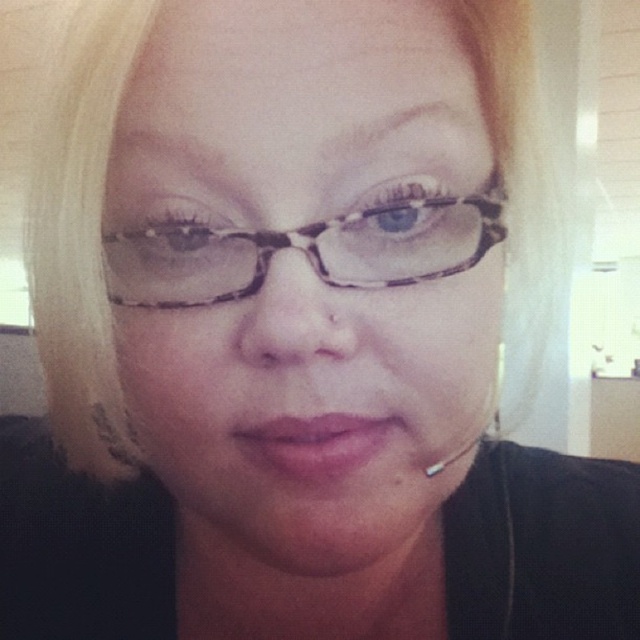
Question: Among these objects, which one is nearest to the camera?

Choices:
 (A) matte black glasses at center
 (B) pink matte lips at center
 (C) translucent tortoiseshell glasses at center

Answer: (A)

Question: Can you confirm if matte black glasses at center is positioned to the right of pink matte lips at center?

Choices:
 (A) no
 (B) yes

Answer: (A)

Question: Which point is closer to the camera?

Choices:
 (A) matte black glasses at center
 (B) translucent tortoiseshell glasses at center

Answer: (A)

Question: Which object appears closest to the camera in this image?

Choices:
 (A) pink matte lips at center
 (B) matte black glasses at center
 (C) translucent tortoiseshell glasses at center

Answer: (B)

Question: Is matte black glasses at center wider than pink matte lips at center?

Choices:
 (A) yes
 (B) no

Answer: (A)

Question: Is translucent tortoiseshell glasses at center above pink matte lips at center?

Choices:
 (A) yes
 (B) no

Answer: (A)